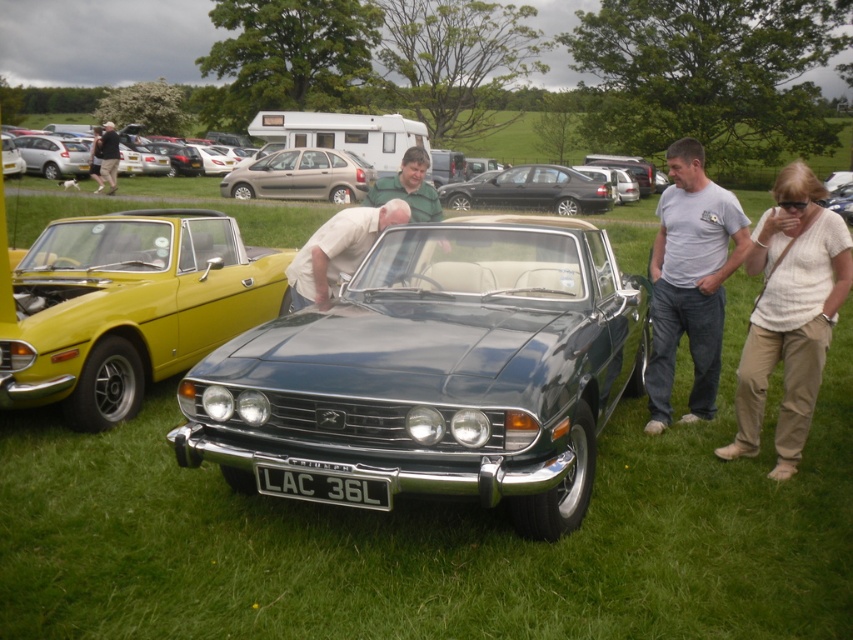
Looking at this image, you are a photographer setting up a tripod to capture both the shiny black sedan at center and the matte yellow car at left in your shot. Given their height difference, which car will appear taller in your photograph?

The shiny black sedan at center will appear taller in the photograph since it has a greater height compared to the matte yellow car at left as stated in the object description.

You are a photographer setting up a wide shot to capture both the shiny black sedan at center and the matte yellow car at left. Given their sizes, which car will appear wider in the photo?

The shiny black sedan at center will appear wider in the photo because its width is larger than the matte yellow car at left.

You are standing at the matte gray hatchback at center and want to walk to the Triumph Stag. How many steps would you need to take if each step covers 0.75 meters?

The distance between the matte gray hatchback at center and the Triumph Stag is 20.36 meters. Dividing 20.36 by 0.75 meters per step gives approximately 27.15 steps. Since you can only take whole steps, you would need to take 28 steps to reach the Triumph Stag.